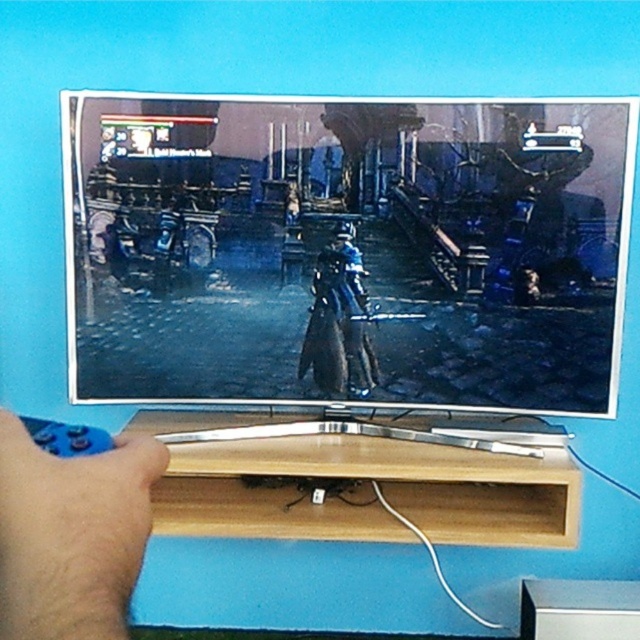
You are a game developer designing a new level for this game. You need to place both the shiny metallic sword at center and the shiny blue armor at center in the level. Which object should you make bigger to maintain consistency with the game scene?

The shiny metallic sword at center should be made bigger than the shiny blue armor at center to maintain consistency with the game scene.

You are a drone operator trying to capture a closeup of the point at coordinates (42,547). The drone is currently 15 inches away from the point. Can you confirm if the drone is close enough to capture the closeup?

The point at coordinates (42,547) is 15.34 inches from the camera. Since the drone is only 15 inches away, it is slightly closer than the required distance, so it should be able to capture the closeup.

You are a person trying to reach the blue matte remote control at lower left from your current position. Based on the coordinates provided in the scene description, can you estimate if the remote control is within arm reach without moving your body?

The blue matte remote control at lower left is located at point (72, 534), which likely places it within arm reach if you are seated near the television. However, exact reachability depends on your current position relative to the coordinates given.